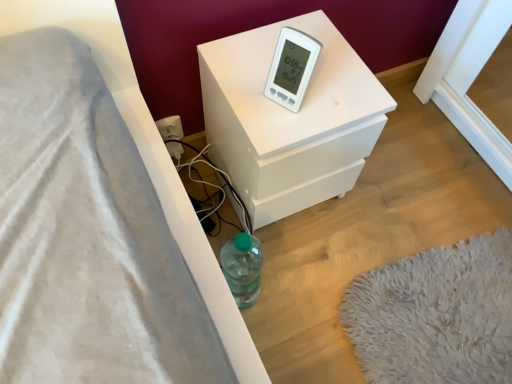
Identify the location of vacant area that is situated to the right of white plastic thermometer at upper center. This screenshot has height=384, width=512. (341, 94).